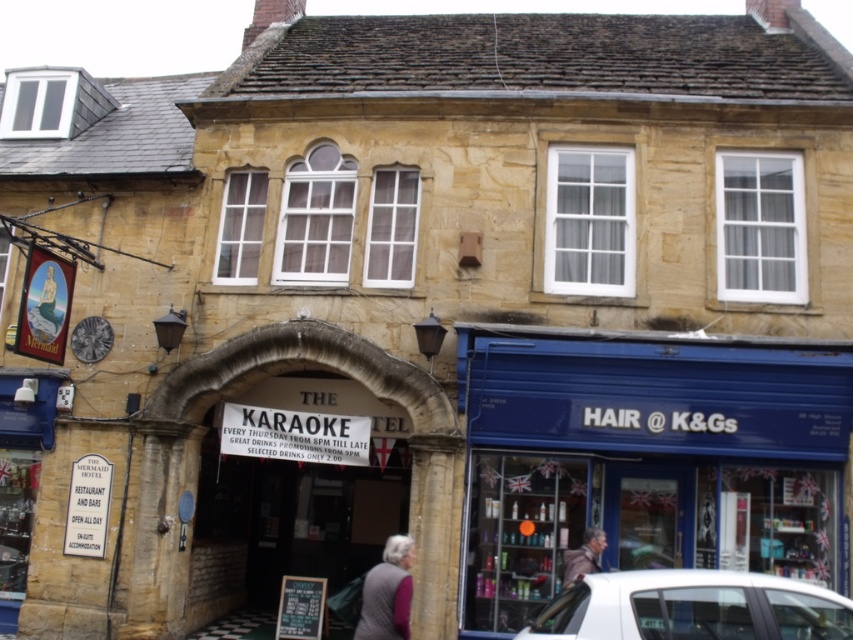
Is blue painted wood hair @ k&gs at lower right positioned behind white glossy car at lower right?

Yes, it is.

Image resolution: width=853 pixels, height=640 pixels. What do you see at coordinates (648, 458) in the screenshot? I see `blue painted wood hair @ k&gs at lower right` at bounding box center [648, 458].

Is point (770, 515) less distant than point (711, 608)?

No, it is behind (711, 608).

The width and height of the screenshot is (853, 640). What are the coordinates of `blue painted wood hair @ k&gs at lower right` in the screenshot? It's located at (648, 458).

Is white glossy car at lower right wider than gray woolen sweater at lower center?

Correct, the width of white glossy car at lower right exceeds that of gray woolen sweater at lower center.

Does white glossy car at lower right appear over gray woolen sweater at lower center?

Yes.

What do you see at coordinates (691, 608) in the screenshot?
I see `white glossy car at lower right` at bounding box center [691, 608].

You are a GUI agent. You are given a task and a screenshot of the screen. Output one action in this format:
    pyautogui.click(x=<x>, y=<y>)
    Task: Click on the white glossy car at lower right
    
    Given the screenshot: What is the action you would take?
    pyautogui.click(x=691, y=608)

Who is more forward, [630,621] or [590,540]?

Point [630,621] is more forward.

Does white glossy car at lower right have a lesser height compared to light brown leather jacket at lower center?

Incorrect, white glossy car at lower right's height does not fall short of light brown leather jacket at lower center's.

This screenshot has width=853, height=640. In order to click on white glossy car at lower right in this screenshot , I will do `click(691, 608)`.